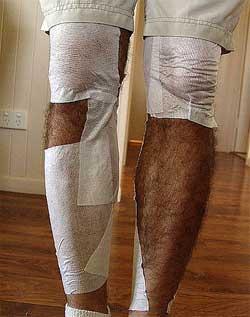
This screenshot has width=250, height=317. Identify the location of sock. (78, 313).